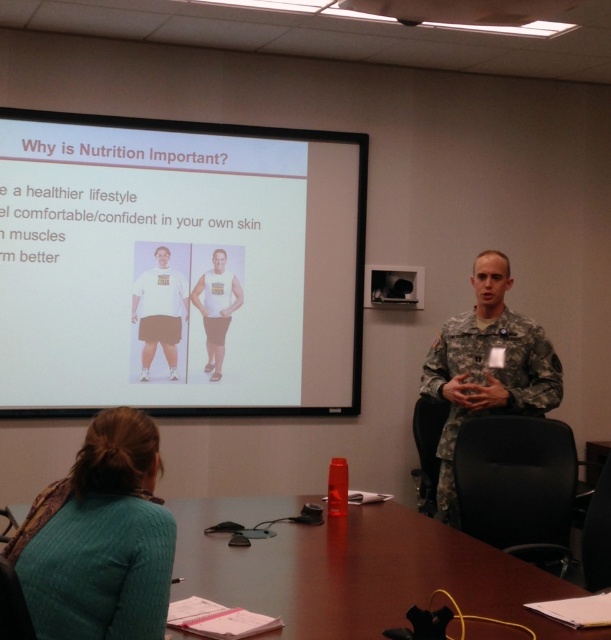
Where is `white matte projector screen at upper center`? This screenshot has height=640, width=611. white matte projector screen at upper center is located at coordinates (178, 264).

Which is more to the right, white matte projector screen at upper center or teal knitted sweater at lower left?

From the viewer's perspective, teal knitted sweater at lower left appears more on the right side.

Between point (45, 412) and point (87, 540), which one is positioned in front?

Point (87, 540)

You are a GUI agent. You are given a task and a screenshot of the screen. Output one action in this format:
    pyautogui.click(x=<x>, y=<y>)
    Task: Click on the white matte projector screen at upper center
    Image resolution: width=611 pixels, height=640 pixels.
    Given the screenshot: What is the action you would take?
    pyautogui.click(x=178, y=264)

Is point (221, 353) less distant than point (207, 294)?

No, (221, 353) is further to viewer.

Does white matte tank top at center have a greater width compared to camouflage fabric uniform at center?

Yes, white matte tank top at center is wider than camouflage fabric uniform at center.

Does point (229, 292) come in front of point (210, 337)?

No, (229, 292) is behind (210, 337).

Find the location of a particular element. white matte tank top at center is located at coordinates (216, 308).

Is wooden table at center positioned at the back of camouflage uniform at center?

That is False.

Who is shorter, wooden table at center or camouflage uniform at center?

wooden table at center

Is point (194, 528) farther from viewer compared to point (514, 397)?

No, it is not.

Locate an element on the screen. wooden table at center is located at coordinates (354, 570).